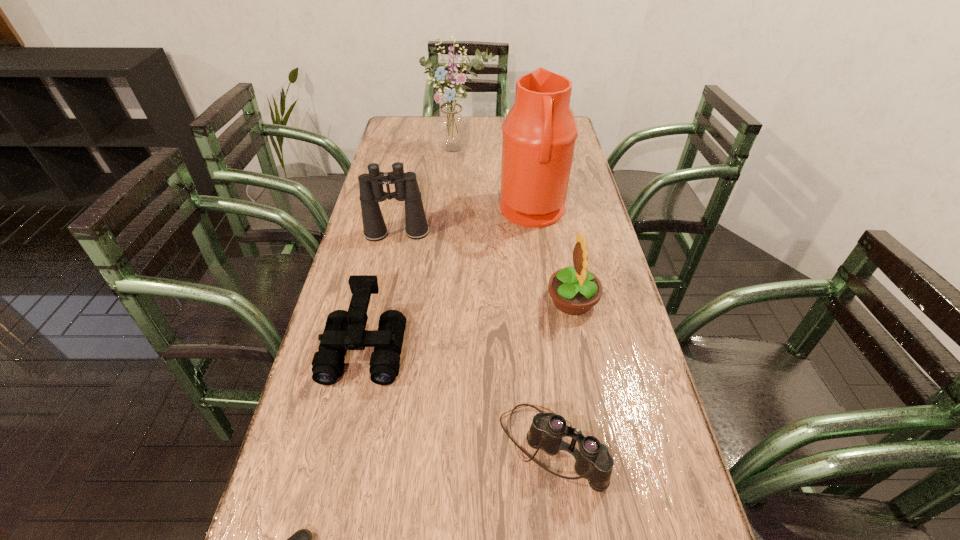
Where is `sunflower positioned at the right edge`? This screenshot has width=960, height=540. sunflower positioned at the right edge is located at coordinates (574, 290).

Identify the location of binoculars located in the right edge section of the desktop. This screenshot has width=960, height=540. coord(594,462).

Locate an element on the screen. free space at the far edge of the desktop is located at coordinates (476, 127).

At what (x,y) coordinates should I click in order to perform the action: click on vacant area at the left edge. Please return your answer as a coordinate pair (x, y). The image size is (960, 540). Looking at the image, I should click on (320, 399).

Find the location of a particular element. This screenshot has width=960, height=540. vacant space at the right edge of the desktop is located at coordinates (646, 500).

The height and width of the screenshot is (540, 960). In order to click on free space between the second shortest object and the bouquet in this screenshot , I will do `click(505, 299)`.

Find the location of a particular element. vacant space in between the shortest binoculars and the sunflower is located at coordinates (562, 373).

This screenshot has height=540, width=960. I want to click on vacant area that lies between the tallest binoculars and the sunflower, so click(x=485, y=267).

Where is `object that is the fifth closest to the shortest object`? object that is the fifth closest to the shortest object is located at coordinates 539,133.

Locate an element on the screen. the fourth closest object to the water jug is located at coordinates (344, 330).